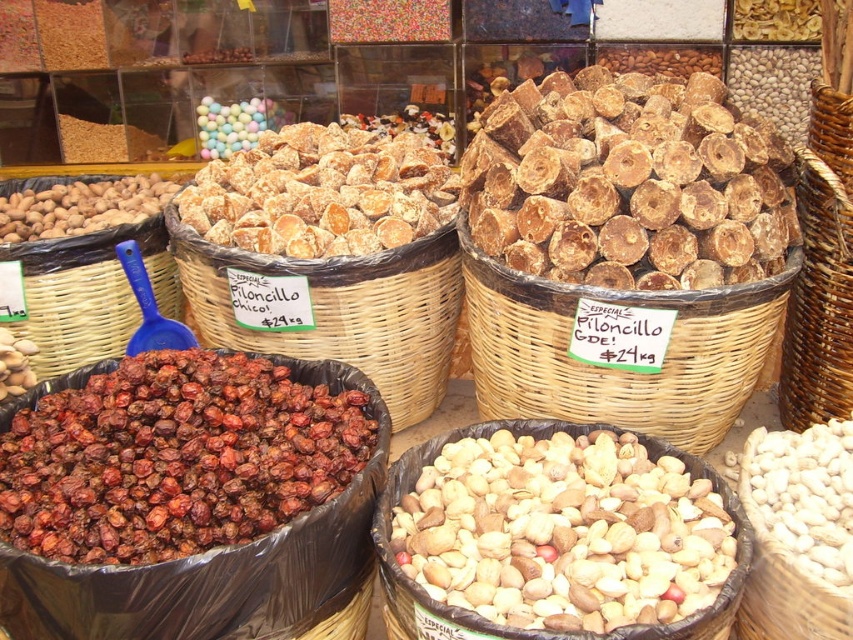
Looking at this image, you are a customer at the market stall and want to place the woven brown basket at center on top of the pastel glossy balls at upper center. Based on their sizes, do you think the basket will fit?

The woven brown basket at center has a lesser width compared to pastel glossy balls at upper center, so the basket will fit on top of the pastel glossy balls at upper center since it is narrower.

You are a customer at the market stall and want to buy the brown matte dried fruits at lower left and the woven brown basket at upper right. Which item is positioned lower in the image?

The brown matte dried fruits at lower left is located below the woven brown basket at upper right, so the brown matte dried fruits at lower left is positioned lower in the image.

You are a customer trying to buy a gift basket for a friend. You see the brown matte dried fruits at lower left and the woven brown basket at upper right. Which item is wider?

The brown matte dried fruits at lower left are wider than the woven brown basket at upper right.